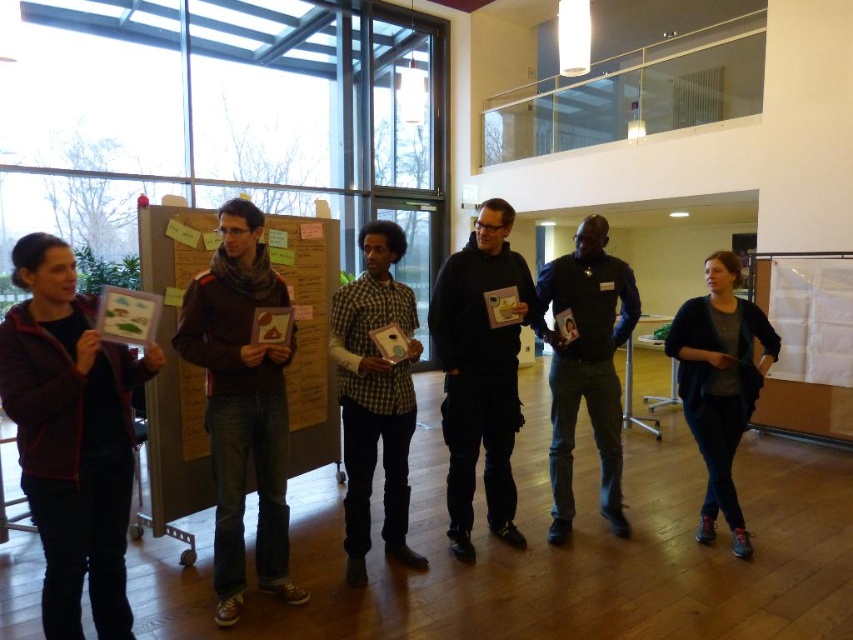
Which of these two, black matte hoodie at center or black matte jacket at center, stands shorter?

black matte jacket at center

What do you see at coordinates (479, 374) in the screenshot?
I see `black matte hoodie at center` at bounding box center [479, 374].

At what (x,y) coordinates should I click in order to perform the action: click on black matte hoodie at center. Please return your answer as a coordinate pair (x, y). This screenshot has width=853, height=640. Looking at the image, I should click on (479, 374).

This screenshot has width=853, height=640. What do you see at coordinates (375, 397) in the screenshot?
I see `checkered fabric shirt at center` at bounding box center [375, 397].

Looking at this image, does checkered fabric shirt at center appear on the right side of black matte jacket at center?

Incorrect, checkered fabric shirt at center is not on the right side of black matte jacket at center.

Between point (344, 353) and point (561, 339), which one is positioned behind?

Point (561, 339)

You are a GUI agent. You are given a task and a screenshot of the screen. Output one action in this format:
    pyautogui.click(x=<x>, y=<y>)
    Task: Click on the checkered fabric shirt at center
    This screenshot has width=853, height=640.
    Given the screenshot: What is the action you would take?
    pyautogui.click(x=375, y=397)

Is dark brown leather jacket at left to the right of black matte hoodie at center from the viewer's perspective?

Incorrect, dark brown leather jacket at left is not on the right side of black matte hoodie at center.

Where is `dark brown leather jacket at left`? dark brown leather jacket at left is located at coordinates (71, 436).

Is point (117, 490) positioned after point (450, 509)?

That is False.

Where is `dark brown leather jacket at left`? This screenshot has height=640, width=853. dark brown leather jacket at left is located at coordinates 71,436.